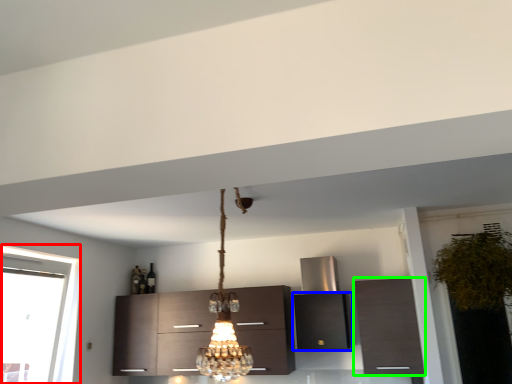
Question: Based on their relative distances, which object is nearer to window (highlighted by a red box)? Choose from cabinetry (highlighted by a blue box) and cabinetry (highlighted by a green box).

Choices:
 (A) cabinetry
 (B) cabinetry

Answer: (A)